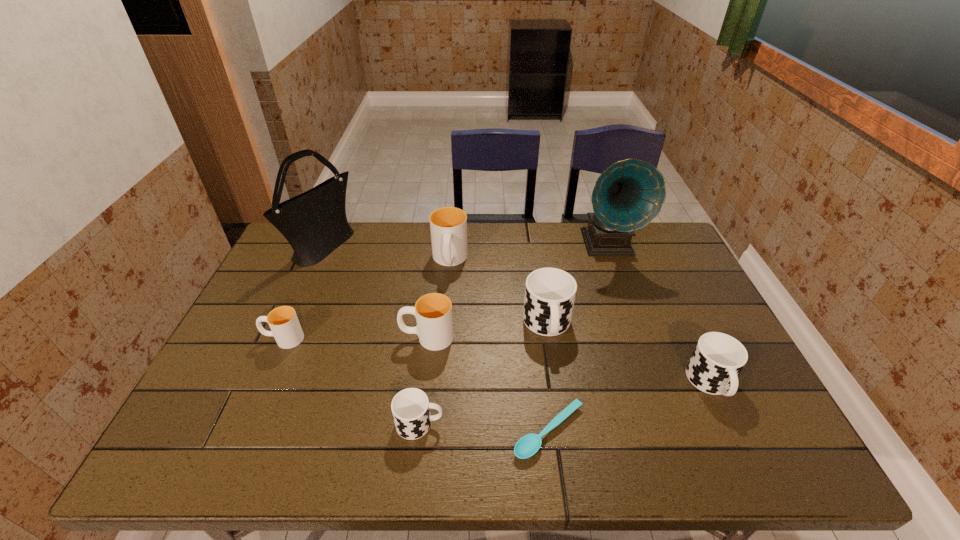
The height and width of the screenshot is (540, 960). I want to click on the smallest yellow cup, so click(284, 324).

The image size is (960, 540). I want to click on the smallest black cup, so click(x=410, y=407).

I want to click on spoon, so tap(528, 445).

At what (x,y) coordinates should I click in order to perform the action: click on the shortest object. Please return your answer as a coordinate pair (x, y). Looking at the image, I should click on (528, 445).

Where is `free region located 0.280m from the horn of the phonograph_record`? free region located 0.280m from the horn of the phonograph_record is located at coordinates (639, 333).

What are the coordinates of `blank area located 0.150m on the right of the shoulder bag` in the screenshot? It's located at (396, 248).

Image resolution: width=960 pixels, height=540 pixels. In order to click on vacant space located with the handle on the side of the farthest cup in this screenshot , I will do `click(444, 335)`.

Find the location of `vacant space situated 0.110m on the side of the biggest black cup with the handle`. vacant space situated 0.110m on the side of the biggest black cup with the handle is located at coordinates (557, 386).

Locate an element on the screen. vacant space located 0.170m with the handle on the side of the second smallest yellow cup is located at coordinates (338, 337).

Where is `free space located with the handle on the side of the second smallest yellow cup`? The width and height of the screenshot is (960, 540). free space located with the handle on the side of the second smallest yellow cup is located at coordinates [x=371, y=337].